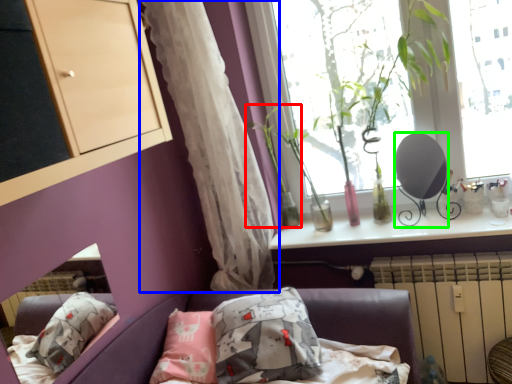
Question: Which object is positioned farthest from plant (highlighted by a red box)? Select from curtain (highlighted by a blue box) and mirror (highlighted by a green box).

Choices:
 (A) curtain
 (B) mirror

Answer: (B)